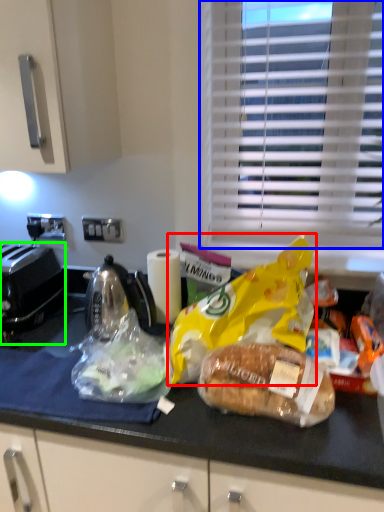
Question: Based on their relative distances, which object is nearer to plastic bag (highlighted by a red box)? Choose from window blind (highlighted by a blue box) and toaster (highlighted by a green box).

Choices:
 (A) window blind
 (B) toaster

Answer: (A)